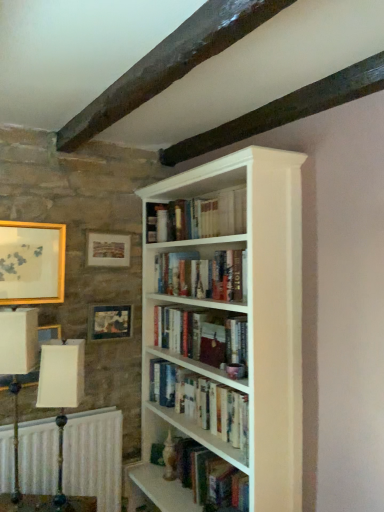
Question: In the image, is white fabric lampshade at left, the 1th table lamp positioned from the right, on the left side or the right side of white wood bookshelf at center?

Choices:
 (A) right
 (B) left

Answer: (B)

Question: In terms of size, does white fabric lampshade at left, the second table lamp in the left-to-right sequence, appear bigger or smaller than white wood bookshelf at center?

Choices:
 (A) big
 (B) small

Answer: (B)

Question: Which of these objects is positioned farthest from the white textured radiator at lower left?

Choices:
 (A) white wood bookshelf at center
 (B) hardcover books at center, acting as the first book starting from the top
 (C) dark wood beam at upper center
 (D) matte wooden picture frame at upper left, the third picture frame positioned from the left
 (E) wooden picture frame at left, the 3th picture frame when ordered from right to left

Answer: (C)

Question: Which of these objects is positioned farthest from the matte gold picture frame at upper left, positioned as the second picture frame in right-to-left order?

Choices:
 (A) matte wooden picture frame at upper left, which is the 1th picture frame from right to left
 (B) white painted wood bookcase at center
 (C) hardcover books at center, placed as the second book when sorted from top to bottom
 (D) wooden picture frame at left, the 3th picture frame when ordered from right to left
 (E) white textured radiator at lower left

Answer: (E)